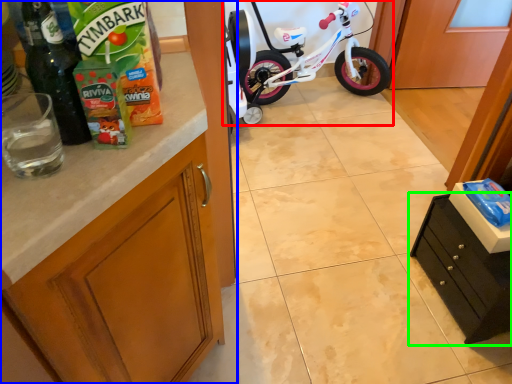
Question: Considering the real-world distances, which object is farthest from bicycle (highlighted by a red box)? cabinetry (highlighted by a blue box) or cabinetry (highlighted by a green box)?

Choices:
 (A) cabinetry
 (B) cabinetry

Answer: (A)